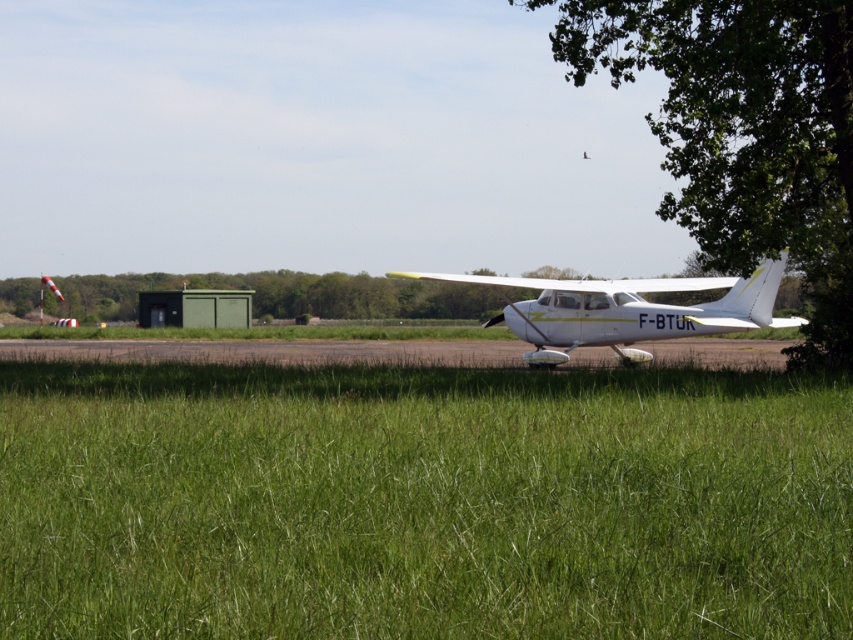
Who is more forward, [302,547] or [590,282]?

Positioned in front is point [302,547].

Is point (73, 605) positioned behind point (554, 300)?

No, it is in front of (554, 300).

Where is `green grass at center`? The width and height of the screenshot is (853, 640). green grass at center is located at coordinates (422, 500).

At what (x,y) coordinates should I click in order to perform the action: click on green grass at center. Please return your answer as a coordinate pair (x, y). The image size is (853, 640). Looking at the image, I should click on (422, 500).

Who is shorter, green grass at center or green leafy tree at right?

green grass at center

Which is in front, point (440, 406) or point (780, 81)?

Point (440, 406) is in front.

At what (x,y) coordinates should I click in order to perform the action: click on green grass at center. Please return your answer as a coordinate pair (x, y). Looking at the image, I should click on (422, 500).

Does green leafy tree at right come in front of white matte airplane at center?

Yes, green leafy tree at right is closer to the viewer.

Is green leafy tree at right thinner than white matte airplane at center?

No, green leafy tree at right is not thinner than white matte airplane at center.

At what (x,y) coordinates should I click in order to perform the action: click on green leafy tree at right. Please return your answer as a coordinate pair (x, y). This screenshot has height=640, width=853. Looking at the image, I should click on (746, 132).